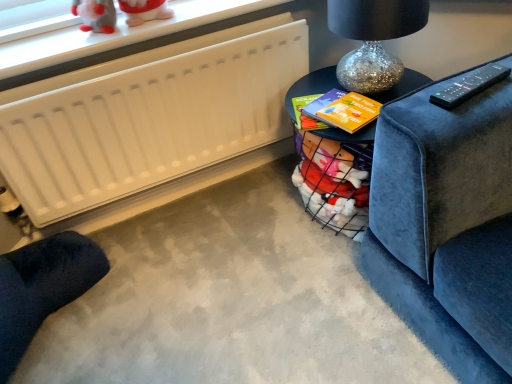
Where is `vacant region above matte black table at upper right, which is the second table from front to back (from a real-world perspective)`? vacant region above matte black table at upper right, which is the second table from front to back (from a real-world perspective) is located at coordinates (345, 103).